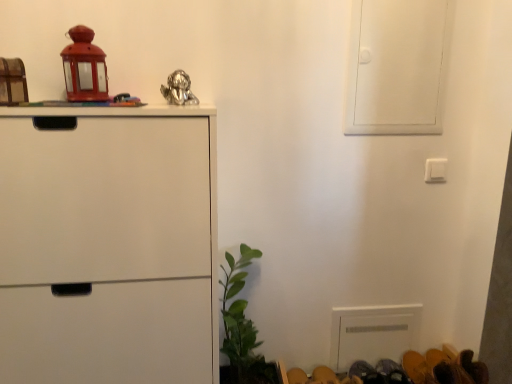
At what (x,y) coordinates should I click in order to perform the action: click on free spot in front of shiny metallic figurine at upper center, which is the 3th toy from left to right. Please return your answer as a coordinate pair (x, y). Looking at the image, I should click on (154, 103).